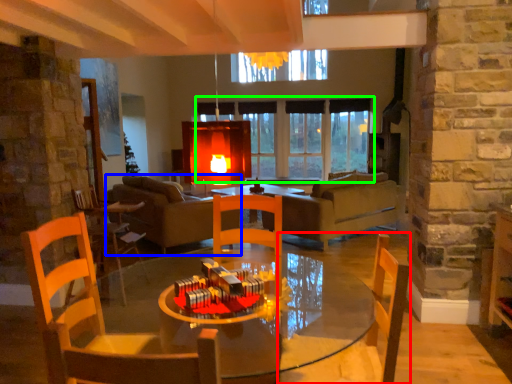
Question: Considering the real-world distances, which object is closest to chair (highlighted by a red box)? studio couch (highlighted by a blue box) or window (highlighted by a green box).

Choices:
 (A) studio couch
 (B) window

Answer: (A)